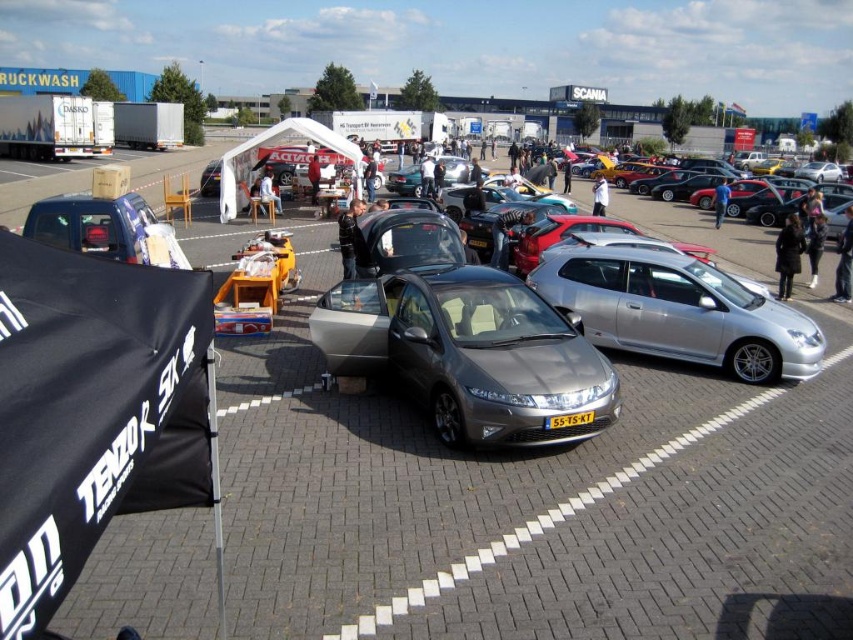
Question: Which point is farther to the camera?

Choices:
 (A) (573, 413)
 (B) (268, 189)
 (C) (549, 317)

Answer: (B)

Question: Estimate the real-world distances between objects in this image. Which object is farther from the white cotton shirt at center?

Choices:
 (A) white fabric at center
 (B) satin metallic hatchback at center
 (C) yellow plastic license plate at center

Answer: (C)

Question: Is the position of black leather jacket at center more distant than that of matte black car at center?

Choices:
 (A) yes
 (B) no

Answer: (B)

Question: Where is dark blue jeans at right located in relation to yellow plastic license plate at center in the image?

Choices:
 (A) below
 (B) above

Answer: (B)

Question: Based on their relative distances, which object is nearer to the black leather jacket at center?

Choices:
 (A) dark gray jacket at center
 (B) blue fabric bag at center
 (C) black leather jacket at lower right
 (D) satin metallic hatchback at center

Answer: (C)

Question: Is silver metallic hatchback at center-right above dark gray fabric jacket at center?

Choices:
 (A) no
 (B) yes

Answer: (A)